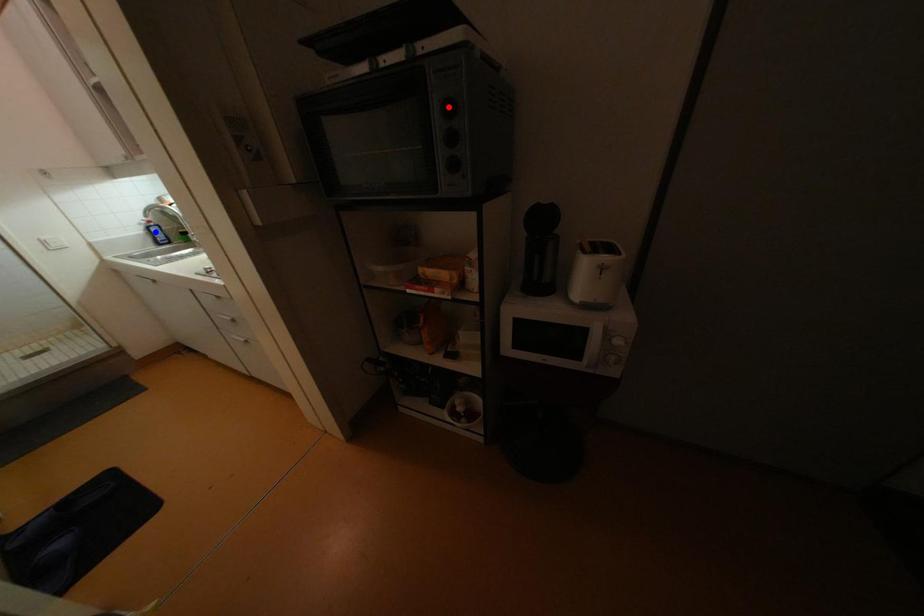
Question: Which of the two points in the image is closer to the camera?

Choices:
 (A) Blue point is closer.
 (B) Red point is closer.

Answer: (B)